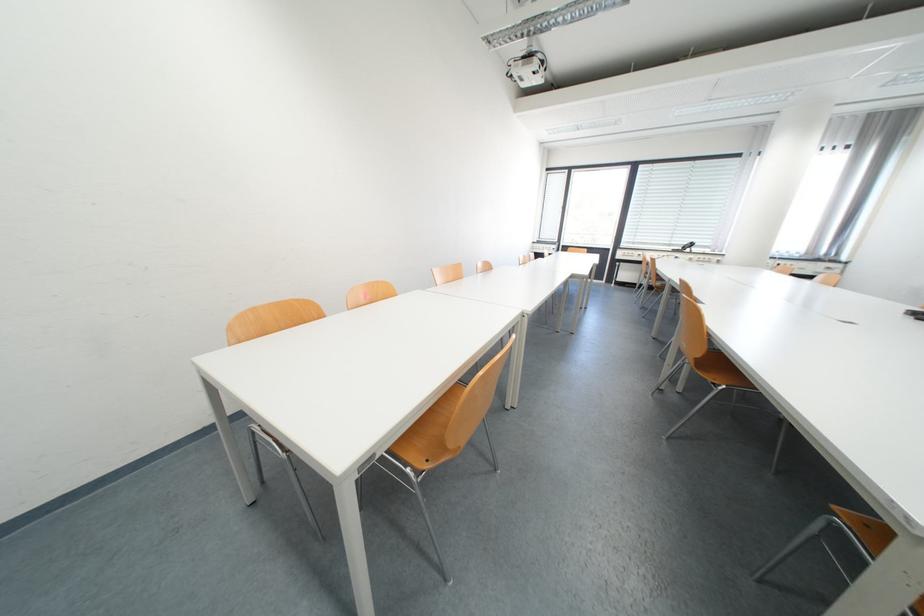
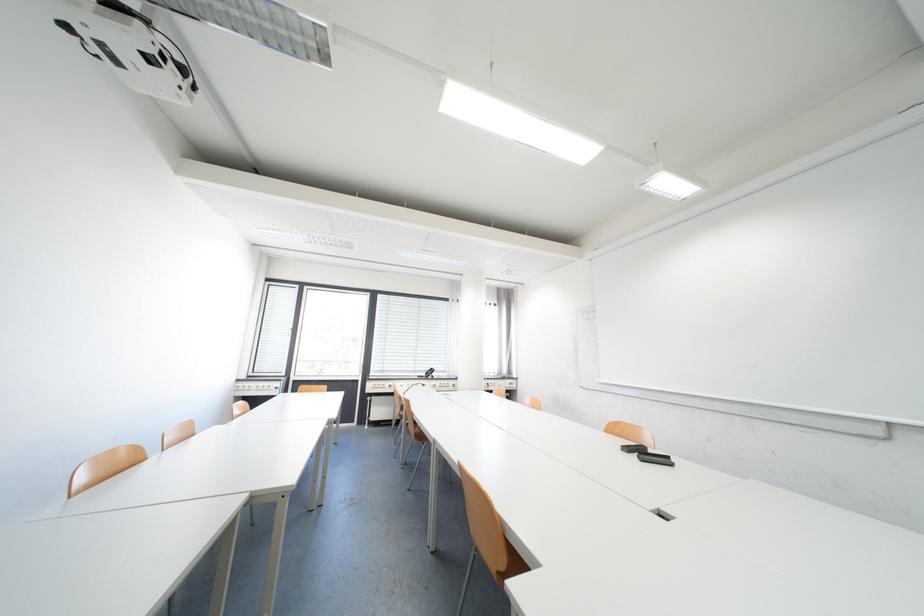
Locate, in the second image, the point that corresponds to (x=531, y=81) in the first image.

(128, 63)